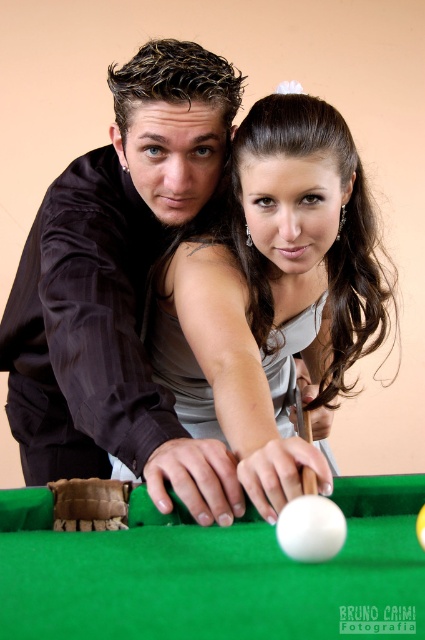
You are a photographer setting up for a photoshoot at the pool table. You need to ensure that the satin silver dress at center and the white matte cue at center are both visible in the frame. Given their sizes, which object should you prioritize positioning closer to the camera to maintain clarity in the photo?

The satin silver dress at center is larger in size than the white matte cue at center, so you should prioritize positioning the white matte cue at center closer to the camera to ensure it appears clear and well detailed in the photo.

You are a photographer setting up for a photoshoot in the scene described. You need to ensure that both the satin silver dress at center and the green felt billiard table at center are visible in the frame. Given their sizes, which object should you prioritize positioning closer to the camera to maintain clarity and detail?

The satin silver dress at center has a larger size compared to the green felt billiard table at center, so you should prioritize positioning the satin silver dress at center closer to the camera to maintain clarity and detail.

You are a photographer setting up for a photoshoot in the scene. You need to place a spotlight on the right side of the satin black shirt at center and another on the left side of the satin silver dress at center. Will the spotlights overlap each other?

The satin black shirt at center is to the left of the satin silver dress at center, so placing a spotlight on the right side of the satin black shirt at center and another on the left side of the satin silver dress at center would mean the spotlights are positioned next to each other without overlapping.